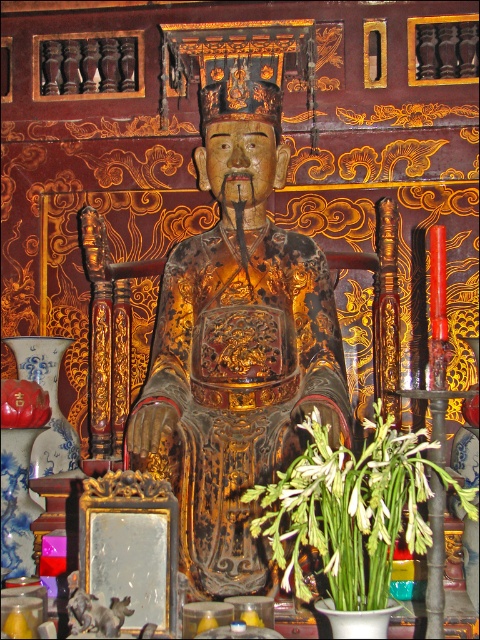
You are an interior designer planning to place a new decorative item in the temple. You have a small golden bell that needs to be placed either next to the glossy wood statue at center or the matte red vase at lower left. Considering the space available next to each object, which location would allow the bell to fit better?

The glossy wood statue at center is wider than the matte red vase at lower left, so placing the small golden bell next to the glossy wood statue at center would provide more space for the bell to fit better.

You are an architect designing a new temple and want to place a statue in the center. The temple has a coordinate system where the bottom left corner is at point 0,0 and the top right corner is at point 1,1. According to the image, where should you place the glossy wood statue at center?

You should place the glossy wood statue at center at point (x=238, y=344).

You are an interior designer planning to add a new decorative item to the temple. You have a small golden statue that needs to be placed either on the green leafy plant at lower center or the matte red vase at lower left. Based on their positions, which object can the golden statue be placed on without obstructing the view of the central figure?

The golden statue can be placed on the matte red vase at lower left because the green leafy plant at lower center is below the matte red vase at lower left, so placing it on the vase would keep it higher and less likely to block the view of the central figure.